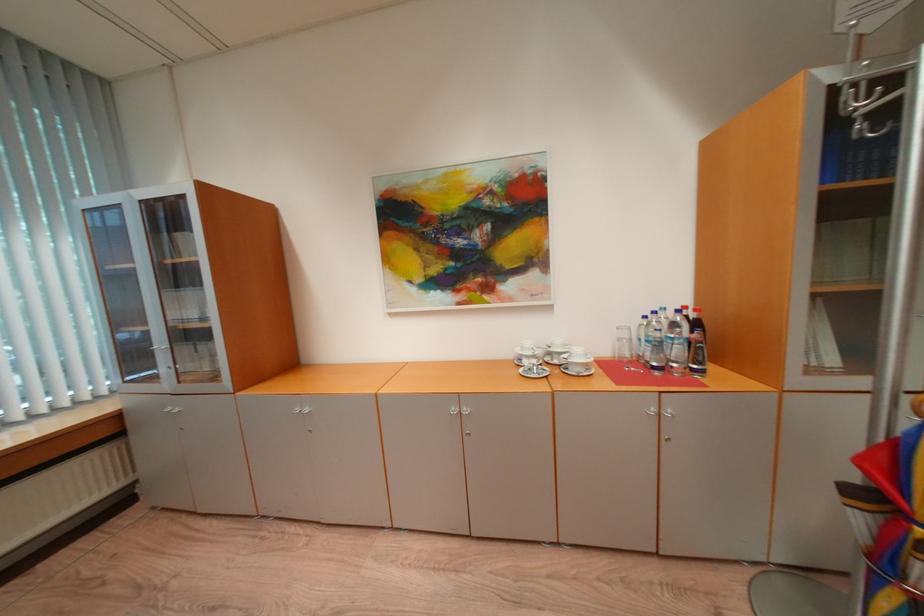
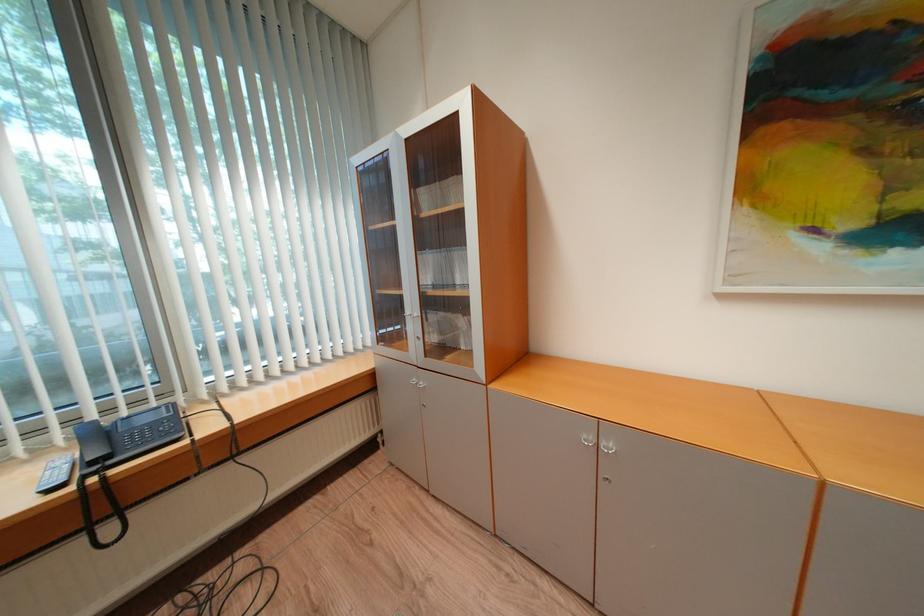
In a continuous first-person perspective shot, in which direction is the camera moving?

The cameraman walked toward left, forward.